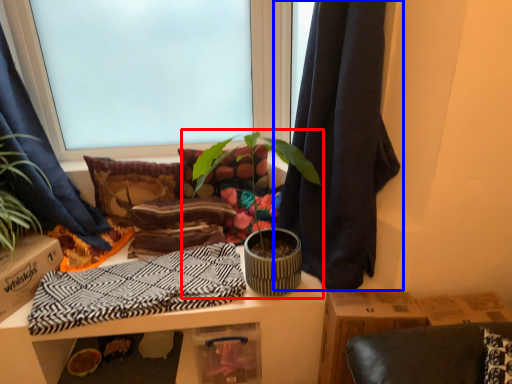
Question: Which object appears farthest to the camera in this image, houseplant (highlighted by a red box) or curtain (highlighted by a blue box)?

Choices:
 (A) houseplant
 (B) curtain

Answer: (A)